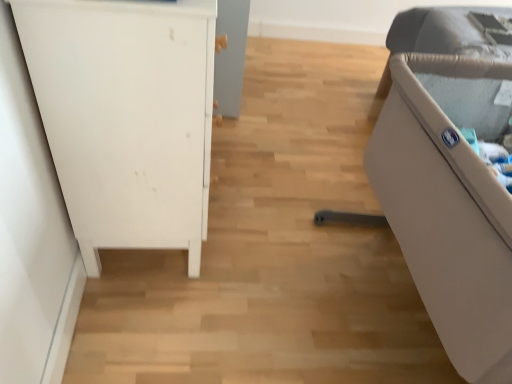
What are the coordinates of `vacant space in between beige plastic crib at right, the 1th furniture when ordered from right to left, and white matte cabinet at left, positioned as the 1th furniture in left-to-right order` in the screenshot? It's located at (261, 251).